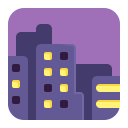
Where is `chimney`? chimney is located at coordinates (43, 27).